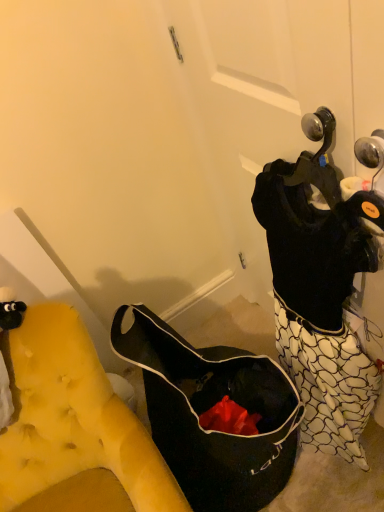
Question: Is black fabric bag at lower left closer to the viewer compared to yellow tufted fabric at left?

Choices:
 (A) yes
 (B) no

Answer: (B)

Question: Can you confirm if black fabric bag at lower left is wider than yellow tufted fabric at left?

Choices:
 (A) yes
 (B) no

Answer: (A)

Question: Can you confirm if black fabric bag at lower left is thinner than yellow tufted fabric at left?

Choices:
 (A) no
 (B) yes

Answer: (A)

Question: From the image's perspective, is black fabric bag at lower left beneath yellow tufted fabric at left?

Choices:
 (A) yes
 (B) no

Answer: (B)

Question: From the image's perspective, is black fabric bag at lower left located above yellow tufted fabric at left?

Choices:
 (A) no
 (B) yes

Answer: (B)

Question: From a real-world perspective, is black fabric bag at lower left over yellow tufted fabric at left?

Choices:
 (A) no
 (B) yes

Answer: (A)

Question: Is yellow tufted fabric at left positioned with its back to black fabric bag at lower left?

Choices:
 (A) yes
 (B) no

Answer: (B)

Question: Is black fabric bag at lower left a part of yellow tufted fabric at left?

Choices:
 (A) no
 (B) yes

Answer: (A)

Question: Are yellow tufted fabric at left and black fabric bag at lower left making contact?

Choices:
 (A) yes
 (B) no

Answer: (B)

Question: Does yellow tufted fabric at left have a smaller size compared to black fabric bag at lower left?

Choices:
 (A) yes
 (B) no

Answer: (B)

Question: Is yellow tufted fabric at left wider than black fabric bag at lower left?

Choices:
 (A) no
 (B) yes

Answer: (A)

Question: Is yellow tufted fabric at left not near black fabric bag at lower left?

Choices:
 (A) no
 (B) yes

Answer: (A)

Question: Looking at their shapes, would you say yellow tufted fabric at left is wider or thinner than black fabric bag at lower left?

Choices:
 (A) thin
 (B) wide

Answer: (A)